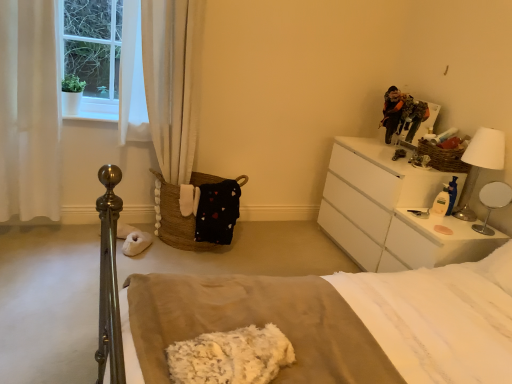
Where is `vacant space to the right of brown woven basket at lower left, positioned as the 2th basket in right-to-left order`? Image resolution: width=512 pixels, height=384 pixels. vacant space to the right of brown woven basket at lower left, positioned as the 2th basket in right-to-left order is located at coordinates (273, 243).